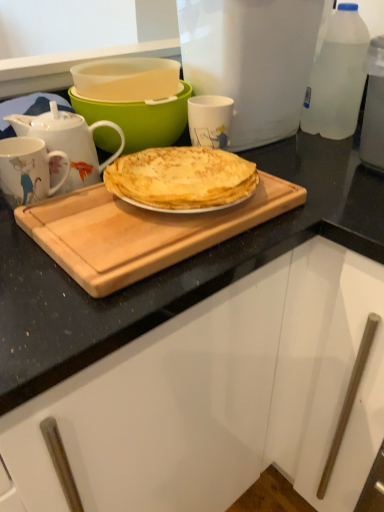
Question: Is the position of porcelain floral mug at left, marked as the 1th coffee cup in a bottom-to-top arrangement, less distant than that of clear plastic bottle at upper right?

Choices:
 (A) no
 (B) yes

Answer: (B)

Question: Can you confirm if porcelain floral mug at left, which ranks as the 1th coffee cup in left-to-right order, is taller than clear plastic bottle at upper right?

Choices:
 (A) no
 (B) yes

Answer: (A)

Question: From a real-world perspective, is porcelain floral mug at left, the second coffee cup when ordered from back to front, physically above clear plastic bottle at upper right?

Choices:
 (A) no
 (B) yes

Answer: (A)

Question: Could clear plastic bottle at upper right be considered to be inside porcelain floral mug at left, marked as the 1th coffee cup in a bottom-to-top arrangement?

Choices:
 (A) yes
 (B) no

Answer: (B)

Question: Considering the relative sizes of porcelain floral mug at left, which ranks as the 1th coffee cup in left-to-right order, and clear plastic bottle at upper right in the image provided, is porcelain floral mug at left, which ranks as the 1th coffee cup in left-to-right order, thinner than clear plastic bottle at upper right?

Choices:
 (A) yes
 (B) no

Answer: (A)

Question: Relative to white glossy mug at upper center, placed as the first coffee cup when sorted from back to front, is matte green bowl at upper center in front or behind?

Choices:
 (A) behind
 (B) front

Answer: (B)

Question: Is matte green bowl at upper center inside the boundaries of white glossy mug at upper center, the first coffee cup in the top-to-bottom sequence, or outside?

Choices:
 (A) outside
 (B) inside

Answer: (A)

Question: Is matte green bowl at upper center to the left or to the right of white glossy mug at upper center, which is counted as the 1th coffee cup, starting from the right, in the image?

Choices:
 (A) right
 (B) left

Answer: (B)

Question: Does point (175, 124) appear closer or farther from the camera than point (216, 143)?

Choices:
 (A) farther
 (B) closer

Answer: (A)

Question: Considering their positions, is white plastic container at upper center located in front of or behind white glossy teapot at upper left?

Choices:
 (A) behind
 (B) front

Answer: (A)

Question: Would you say white plastic container at upper center is to the left or to the right of white glossy teapot at upper left in the picture?

Choices:
 (A) left
 (B) right

Answer: (B)

Question: Is point (258, 17) closer or farther from the camera than point (54, 121)?

Choices:
 (A) farther
 (B) closer

Answer: (A)

Question: Is white plastic container at upper center wider or thinner than white glossy teapot at upper left?

Choices:
 (A) wide
 (B) thin

Answer: (A)

Question: Looking at their shapes, would you say white plastic container at upper center is wider or thinner than white glossy mug at upper center, which appears as the second coffee cup when viewed from the left?

Choices:
 (A) thin
 (B) wide

Answer: (B)

Question: Considering the positions of white plastic container at upper center and white glossy mug at upper center, the 2th coffee cup in the front-to-back sequence, in the image, is white plastic container at upper center taller or shorter than white glossy mug at upper center, the 2th coffee cup in the front-to-back sequence,?

Choices:
 (A) tall
 (B) short

Answer: (A)